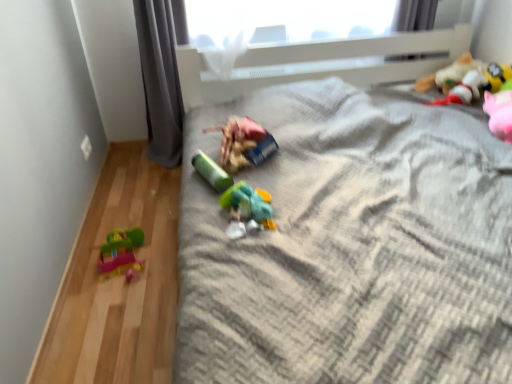
Question: From their relative heights in the image, would you say gray textured blanket at center is taller or shorter than plush yellow toy at upper right, the 6th toy when ordered from left to right?

Choices:
 (A) tall
 (B) short

Answer: (A)

Question: Is gray textured blanket at center inside the boundaries of plush yellow toy at upper right, the 6th toy when ordered from left to right, or outside?

Choices:
 (A) inside
 (B) outside

Answer: (B)

Question: Which object is positioned farthest from the gray fabric curtain at left?

Choices:
 (A) translucent plastic toy at center, which is the fourth toy from left to right
 (B) plush yellow toy at upper right, the 6th toy when ordered from left to right
 (C) gray textured blanket at center
 (D) plastic toy car at left, the first toy from the left
 (E) fuzzy fabric stuffed animal at upper right, which is the 2th toy in right-to-left order

Answer: (B)

Question: Which object is the closest to the fuzzy fabric stuffed animal at upper right, marked as the 5th toy in a left-to-right arrangement?

Choices:
 (A) translucent plastic toy at center, positioned as the third toy in right-to-left order
 (B) matte plastic toy at center, the third toy from the left
 (C) gray fabric curtain at left
 (D) green matte cylinder at center, the 2th toy from the left
 (E) gray textured blanket at center

Answer: (E)